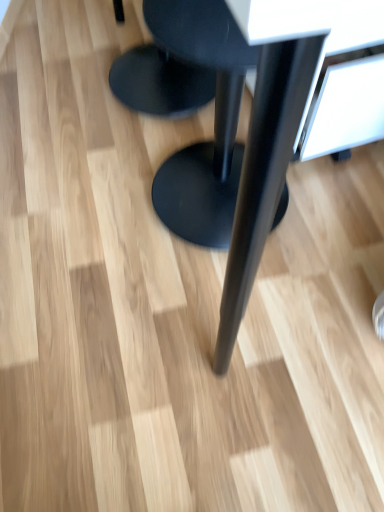
Question: From the image's perspective, is black matte stool at center, which is the second stool in top-to-bottom order, below black matte stool at center, the 2th stool positioned from the bottom?

Choices:
 (A) yes
 (B) no

Answer: (A)

Question: From a real-world perspective, is black matte stool at center, placed as the 1th stool when sorted from bottom to top, on black matte stool at center, the 2th stool positioned from the bottom?

Choices:
 (A) no
 (B) yes

Answer: (B)

Question: From the image's perspective, is black matte stool at center, placed as the 1th stool when sorted from bottom to top, located above black matte stool at center, which is the first stool from top to bottom?

Choices:
 (A) no
 (B) yes

Answer: (A)

Question: Does black matte stool at center, placed as the 1th stool when sorted from bottom to top, have a lesser width compared to black matte stool at center, the 2th stool positioned from the bottom?

Choices:
 (A) no
 (B) yes

Answer: (B)

Question: Can you confirm if black matte stool at center, placed as the 1th stool when sorted from bottom to top, is shorter than black matte stool at center, the 2th stool positioned from the bottom?

Choices:
 (A) no
 (B) yes

Answer: (A)

Question: Is the depth of black matte stool at center, which is the second stool in top-to-bottom order, less than that of black matte stool at center, which is the first stool from top to bottom?

Choices:
 (A) no
 (B) yes

Answer: (B)

Question: From the image's perspective, is black matte stool at center, which is the first stool from top to bottom, over black matte stool at center, placed as the 1th stool when sorted from bottom to top?

Choices:
 (A) no
 (B) yes

Answer: (B)

Question: Does black matte stool at center, the 2th stool positioned from the bottom, have a greater width compared to black matte stool at center, which is the second stool in top-to-bottom order?

Choices:
 (A) yes
 (B) no

Answer: (A)

Question: Is black matte stool at center, which is the first stool from top to bottom, positioned in front of black matte stool at center, placed as the 1th stool when sorted from bottom to top?

Choices:
 (A) no
 (B) yes

Answer: (A)

Question: Is black matte stool at center, the 2th stool positioned from the bottom, facing towards black matte stool at center, which is the second stool in top-to-bottom order?

Choices:
 (A) yes
 (B) no

Answer: (B)

Question: Considering the relative positions of black matte stool at center, which is the first stool from top to bottom, and black matte stool at center, which is the second stool in top-to-bottom order, in the image provided, is black matte stool at center, which is the first stool from top to bottom, to the right of black matte stool at center, which is the second stool in top-to-bottom order, from the viewer's perspective?

Choices:
 (A) no
 (B) yes

Answer: (A)

Question: Considering the relative positions of black matte stool at center, which is the first stool from top to bottom, and black matte stool at center, which is the second stool in top-to-bottom order, in the image provided, is black matte stool at center, which is the first stool from top to bottom, behind black matte stool at center, which is the second stool in top-to-bottom order,?

Choices:
 (A) no
 (B) yes

Answer: (B)

Question: Considering the relative sizes of black matte stool at center, placed as the 1th stool when sorted from bottom to top, and black matte table at center in the image provided, is black matte stool at center, placed as the 1th stool when sorted from bottom to top, smaller than black matte table at center?

Choices:
 (A) no
 (B) yes

Answer: (B)